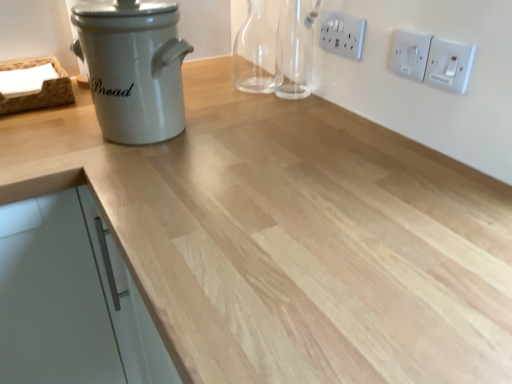
Question: Is white plastic electric outlet at upper right, positioned as the third electric outlet in front-to-back order, aimed at white matte cabinet handle at left?

Choices:
 (A) yes
 (B) no

Answer: (B)

Question: Is white plastic electric outlet at upper right, positioned as the first electric outlet in left-to-right order, turned away from white matte cabinet handle at left?

Choices:
 (A) no
 (B) yes

Answer: (A)

Question: Does white plastic electric outlet at upper right, which is the 1th electric outlet from back to front, have a greater width compared to white matte cabinet handle at left?

Choices:
 (A) no
 (B) yes

Answer: (A)

Question: Is white plastic electric outlet at upper right, positioned as the third electric outlet in front-to-back order, taller than white matte cabinet handle at left?

Choices:
 (A) yes
 (B) no

Answer: (B)

Question: From the image's perspective, would you say white plastic electric outlet at upper right, positioned as the first electric outlet in left-to-right order, is positioned over white matte cabinet handle at left?

Choices:
 (A) no
 (B) yes

Answer: (B)

Question: Considering their positions, is white matte cabinet handle at left located in front of or behind white ceramic bread bin at left?

Choices:
 (A) behind
 (B) front

Answer: (B)

Question: Would you say white matte cabinet handle at left is inside or outside white ceramic bread bin at left?

Choices:
 (A) inside
 (B) outside

Answer: (B)

Question: In terms of height, does white matte cabinet handle at left look taller or shorter compared to white ceramic bread bin at left?

Choices:
 (A) tall
 (B) short

Answer: (A)

Question: From a real-world perspective, is white matte cabinet handle at left above or below white ceramic bread bin at left?

Choices:
 (A) above
 (B) below

Answer: (B)

Question: Is transparent glass bottle at upper center bigger or smaller than white ceramic bread bin at left?

Choices:
 (A) small
 (B) big

Answer: (A)

Question: From a real-world perspective, is transparent glass bottle at upper center above or below white ceramic bread bin at left?

Choices:
 (A) above
 (B) below

Answer: (B)

Question: From the image's perspective, relative to white ceramic bread bin at left, is transparent glass bottle at upper center above or below?

Choices:
 (A) above
 (B) below

Answer: (A)

Question: Is transparent glass bottle at upper center wider or thinner than white ceramic bread bin at left?

Choices:
 (A) thin
 (B) wide

Answer: (A)

Question: From a real-world perspective, relative to transparent glass bottle at upper center, is white ceramic bread bin at left vertically above or below?

Choices:
 (A) below
 (B) above

Answer: (B)

Question: Does point (172, 124) appear closer or farther from the camera than point (245, 34)?

Choices:
 (A) farther
 (B) closer

Answer: (B)